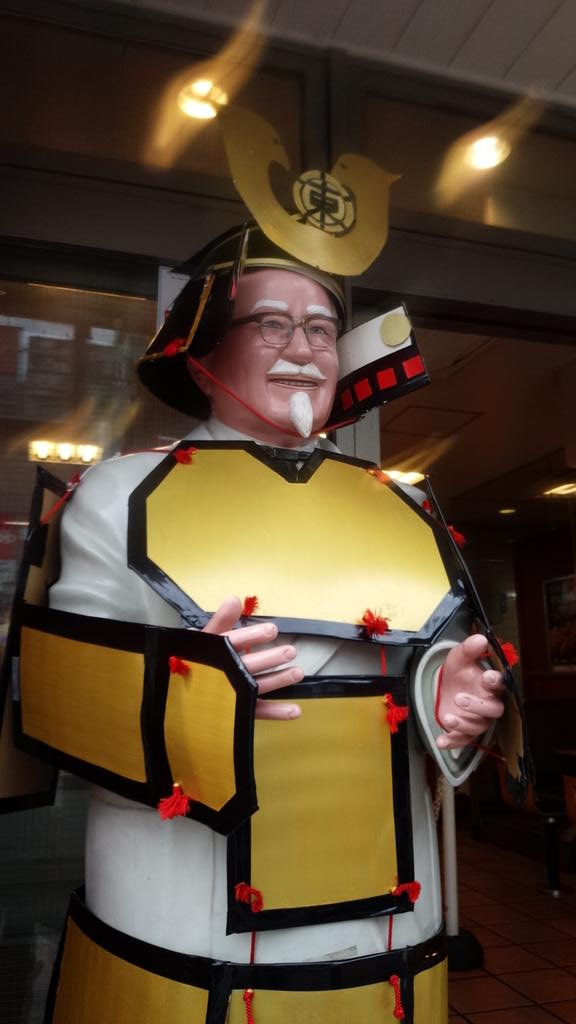
This screenshot has height=1024, width=576. I want to click on tiled flooring, so click(x=507, y=962).